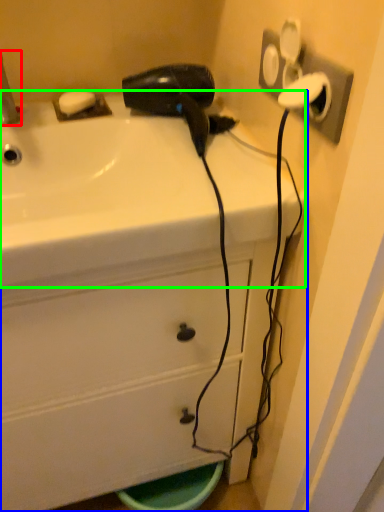
Question: Which is nearer to the faucet (highlighted by a red box)? bathroom cabinet (highlighted by a blue box) or sink (highlighted by a green box).

Choices:
 (A) bathroom cabinet
 (B) sink

Answer: (B)